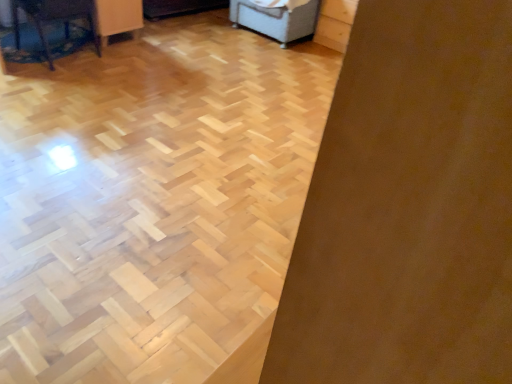
Image resolution: width=512 pixels, height=384 pixels. Describe the element at coordinates (276, 20) in the screenshot. I see `light gray fabric ottoman at upper center, acting as the second furniture starting from the front` at that location.

What is the approximate width of light gray fabric ottoman at upper center, acting as the second furniture starting from the front?

The width of light gray fabric ottoman at upper center, acting as the second furniture starting from the front, is 86.64 centimeters.

Locate an element on the screen. light gray fabric ottoman at upper center, acting as the second furniture starting from the front is located at coordinates (276, 20).

What do you see at coordinates (54, 20) in the screenshot? This screenshot has width=512, height=384. I see `wooden table at left, arranged as the second furniture when viewed from the back` at bounding box center [54, 20].

You are a GUI agent. You are given a task and a screenshot of the screen. Output one action in this format:
    pyautogui.click(x=<x>, y=<y>)
    Task: Click on the wooden table at left, arranged as the second furniture when viewed from the back
    
    Given the screenshot: What is the action you would take?
    pyautogui.click(x=54, y=20)

Locate an element on the screen. Image resolution: width=512 pixels, height=384 pixels. light gray fabric ottoman at upper center, placed as the first furniture when sorted from right to left is located at coordinates (276, 20).

Is wooden table at left, which appears as the 1th furniture when viewed from the front, to the right of light gray fabric ottoman at upper center, which is the 2th furniture from left to right, from the viewer's perspective?

No, wooden table at left, which appears as the 1th furniture when viewed from the front, is not to the right of light gray fabric ottoman at upper center, which is the 2th furniture from left to right.

Considering their positions, is wooden table at left, arranged as the 2th furniture when viewed from the right, located in front of or behind light gray fabric ottoman at upper center, placed as the first furniture when sorted from right to left?

Visually, wooden table at left, arranged as the 2th furniture when viewed from the right, is located in front of light gray fabric ottoman at upper center, placed as the first furniture when sorted from right to left.

Is point (26, 11) closer to viewer compared to point (287, 24)?

Yes, it is.

From the image's perspective, does wooden table at left, arranged as the second furniture when viewed from the back, appear lower than light gray fabric ottoman at upper center, placed as the first furniture when sorted from right to left?

Indeed, from the image's perspective, wooden table at left, arranged as the second furniture when viewed from the back, is shown beneath light gray fabric ottoman at upper center, placed as the first furniture when sorted from right to left.

Looking at this image, from a real-world perspective, is wooden table at left, arranged as the second furniture when viewed from the back, physically above light gray fabric ottoman at upper center, placed as the first furniture when sorted from right to left?

Yes, from a real-world perspective, wooden table at left, arranged as the second furniture when viewed from the back, is above light gray fabric ottoman at upper center, placed as the first furniture when sorted from right to left.

Considering the sizes of objects wooden table at left, positioned as the 1th furniture in left-to-right order, and light gray fabric ottoman at upper center, placed as the first furniture when sorted from right to left, in the image provided, who is thinner, wooden table at left, positioned as the 1th furniture in left-to-right order, or light gray fabric ottoman at upper center, placed as the first furniture when sorted from right to left,?

With smaller width is wooden table at left, positioned as the 1th furniture in left-to-right order.

Based on the photo, is wooden table at left, which appears as the 1th furniture when viewed from the front, shorter than light gray fabric ottoman at upper center, which is the first furniture in back-to-front order?

In fact, wooden table at left, which appears as the 1th furniture when viewed from the front, may be taller than light gray fabric ottoman at upper center, which is the first furniture in back-to-front order.

Considering the relative sizes of wooden table at left, positioned as the 1th furniture in left-to-right order, and light gray fabric ottoman at upper center, which is the first furniture in back-to-front order, in the image provided, is wooden table at left, positioned as the 1th furniture in left-to-right order, smaller than light gray fabric ottoman at upper center, which is the first furniture in back-to-front order,?

Correct, wooden table at left, positioned as the 1th furniture in left-to-right order, occupies less space than light gray fabric ottoman at upper center, which is the first furniture in back-to-front order.

Is light gray fabric ottoman at upper center, placed as the first furniture when sorted from right to left, a part of wooden table at left, which appears as the 1th furniture when viewed from the front?

No.

Are wooden table at left, positioned as the 1th furniture in left-to-right order, and light gray fabric ottoman at upper center, which is the first furniture in back-to-front order, beside each other?

wooden table at left, positioned as the 1th furniture in left-to-right order, and light gray fabric ottoman at upper center, which is the first furniture in back-to-front order, are clearly separated.

Is wooden table at left, positioned as the 1th furniture in left-to-right order, oriented away from light gray fabric ottoman at upper center, placed as the first furniture when sorted from right to left?

No, wooden table at left, positioned as the 1th furniture in left-to-right order, is not facing the opposite direction of light gray fabric ottoman at upper center, placed as the first furniture when sorted from right to left.

Can you tell me how much wooden table at left, arranged as the 2th furniture when viewed from the right, and light gray fabric ottoman at upper center, placed as the first furniture when sorted from right to left, differ in facing direction?

The angular difference between wooden table at left, arranged as the 2th furniture when viewed from the right, and light gray fabric ottoman at upper center, placed as the first furniture when sorted from right to left, is 91.1 degrees.

Could you measure the distance between wooden table at left, arranged as the second furniture when viewed from the back, and light gray fabric ottoman at upper center, acting as the second furniture starting from the front?

wooden table at left, arranged as the second furniture when viewed from the back, and light gray fabric ottoman at upper center, acting as the second furniture starting from the front, are 1.57 meters apart from each other.

Where is `furniture lying on the left of light gray fabric ottoman at upper center, acting as the second furniture starting from the front`? The height and width of the screenshot is (384, 512). furniture lying on the left of light gray fabric ottoman at upper center, acting as the second furniture starting from the front is located at coordinates (54, 20).

Considering the relative positions of light gray fabric ottoman at upper center, placed as the first furniture when sorted from right to left, and wooden table at left, positioned as the 1th furniture in left-to-right order, in the image provided, is light gray fabric ottoman at upper center, placed as the first furniture when sorted from right to left, to the right of wooden table at left, positioned as the 1th furniture in left-to-right order, from the viewer's perspective?

→ Yes, light gray fabric ottoman at upper center, placed as the first furniture when sorted from right to left, is to the right of wooden table at left, positioned as the 1th furniture in left-to-right order.

From the picture: Is the depth of light gray fabric ottoman at upper center, which is the first furniture in back-to-front order, less than that of wooden table at left, which appears as the 1th furniture when viewed from the front?

No, it is behind wooden table at left, which appears as the 1th furniture when viewed from the front.

Is point (301, 34) behind point (66, 13)?

Yes.

From the image's perspective, between light gray fabric ottoman at upper center, which is the 2th furniture from left to right, and wooden table at left, which appears as the 1th furniture when viewed from the front, which one is located above?

light gray fabric ottoman at upper center, which is the 2th furniture from left to right, is shown above in the image.

From a real-world perspective, is light gray fabric ottoman at upper center, placed as the first furniture when sorted from right to left, below wooden table at left, arranged as the 2th furniture when viewed from the right?

Yes, from a real-world perspective, light gray fabric ottoman at upper center, placed as the first furniture when sorted from right to left, is below wooden table at left, arranged as the 2th furniture when viewed from the right.

Looking at this image, is light gray fabric ottoman at upper center, acting as the second furniture starting from the front, thinner than wooden table at left, arranged as the second furniture when viewed from the back?

In fact, light gray fabric ottoman at upper center, acting as the second furniture starting from the front, might be wider than wooden table at left, arranged as the second furniture when viewed from the back.

From their relative heights in the image, would you say light gray fabric ottoman at upper center, which is the first furniture in back-to-front order, is taller or shorter than wooden table at left, arranged as the 2th furniture when viewed from the right?

Clearly, light gray fabric ottoman at upper center, which is the first furniture in back-to-front order, is shorter compared to wooden table at left, arranged as the 2th furniture when viewed from the right.

Considering the relative sizes of light gray fabric ottoman at upper center, which is the first furniture in back-to-front order, and wooden table at left, which appears as the 1th furniture when viewed from the front, in the image provided, is light gray fabric ottoman at upper center, which is the first furniture in back-to-front order, bigger than wooden table at left, which appears as the 1th furniture when viewed from the front,?

Yes, light gray fabric ottoman at upper center, which is the first furniture in back-to-front order, is bigger than wooden table at left, which appears as the 1th furniture when viewed from the front.

Which is correct: light gray fabric ottoman at upper center, which is the first furniture in back-to-front order, is inside wooden table at left, positioned as the 1th furniture in left-to-right order, or outside of it?

light gray fabric ottoman at upper center, which is the first furniture in back-to-front order, cannot be found inside wooden table at left, positioned as the 1th furniture in left-to-right order.

Is light gray fabric ottoman at upper center, placed as the first furniture when sorted from right to left, with wooden table at left, arranged as the 2th furniture when viewed from the right?

They are not placed beside each other.

Is wooden table at left, arranged as the second furniture when viewed from the back, at the back of light gray fabric ottoman at upper center, placed as the first furniture when sorted from right to left?

That's not correct — light gray fabric ottoman at upper center, placed as the first furniture when sorted from right to left, is not looking away from wooden table at left, arranged as the second furniture when viewed from the back.

Looking at this image, can you tell me how much light gray fabric ottoman at upper center, acting as the second furniture starting from the front, and wooden table at left, arranged as the second furniture when viewed from the back, differ in facing direction?

There is a 91.1-degree angle between the facing directions of light gray fabric ottoman at upper center, acting as the second furniture starting from the front, and wooden table at left, arranged as the second furniture when viewed from the back.

This screenshot has width=512, height=384. What are the coordinates of `furniture that is on the left side of light gray fabric ottoman at upper center, which is the first furniture in back-to-front order` in the screenshot? It's located at (54, 20).

Where is `furniture above the light gray fabric ottoman at upper center, placed as the first furniture when sorted from right to left (from a real-world perspective)`? The image size is (512, 384). furniture above the light gray fabric ottoman at upper center, placed as the first furniture when sorted from right to left (from a real-world perspective) is located at coordinates (54, 20).

You are a GUI agent. You are given a task and a screenshot of the screen. Output one action in this format:
    pyautogui.click(x=<x>, y=<y>)
    Task: Click on the furniture behind the wooden table at left, which appears as the 1th furniture when viewed from the front
    The image size is (512, 384).
    Given the screenshot: What is the action you would take?
    pyautogui.click(x=276, y=20)